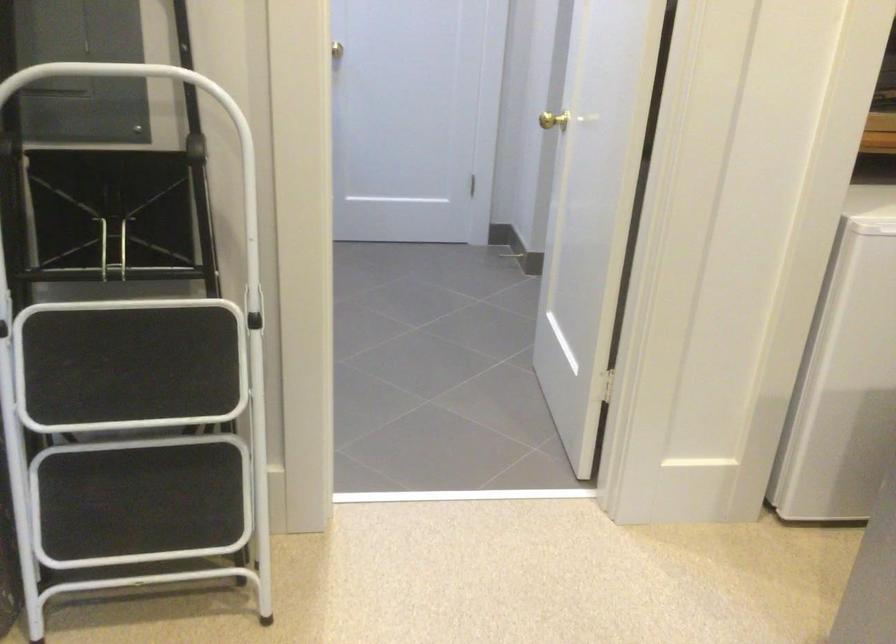
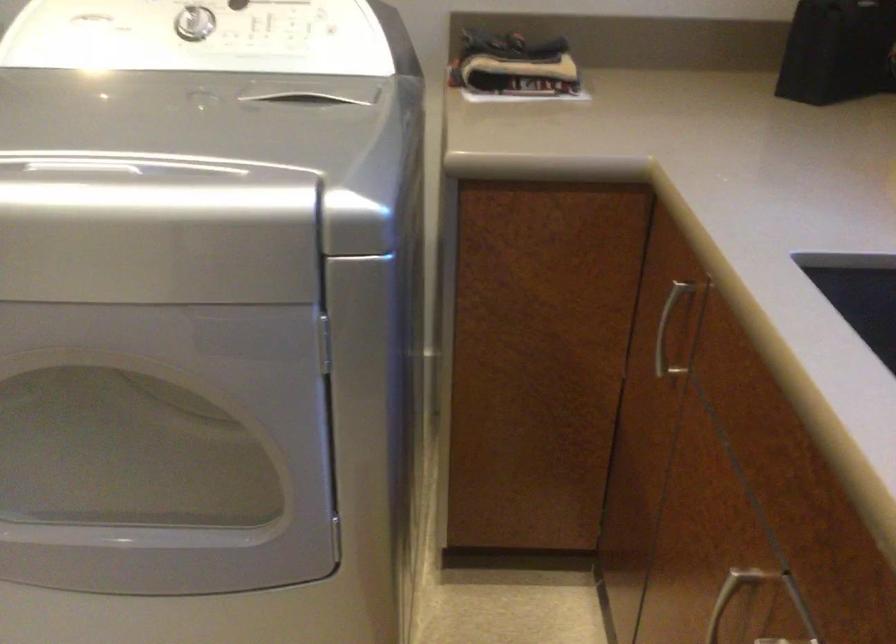
The images are taken continuously from a first-person perspective. In which direction is your viewpoint rotating?

The camera's rotation is toward right-down.